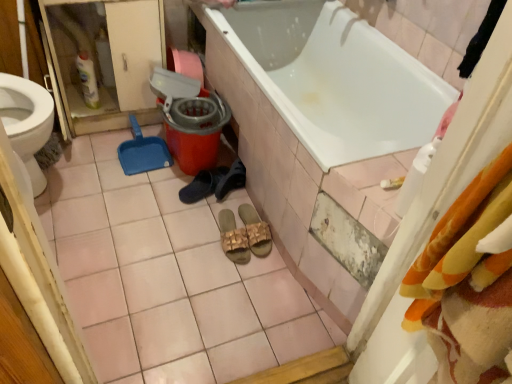
Locate an element on the screen. empty space that is ontop of black rubber slipper at center, acting as the 3th footwear starting from the right is located at coordinates [x=210, y=180].